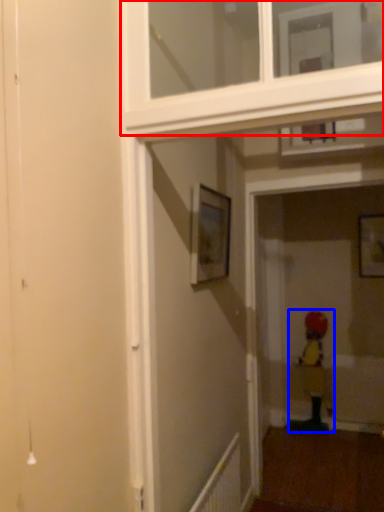
Question: Which object appears farthest to the camera in this image, window frame (highlighted by a red box) or child (highlighted by a blue box)?

Choices:
 (A) window frame
 (B) child

Answer: (B)